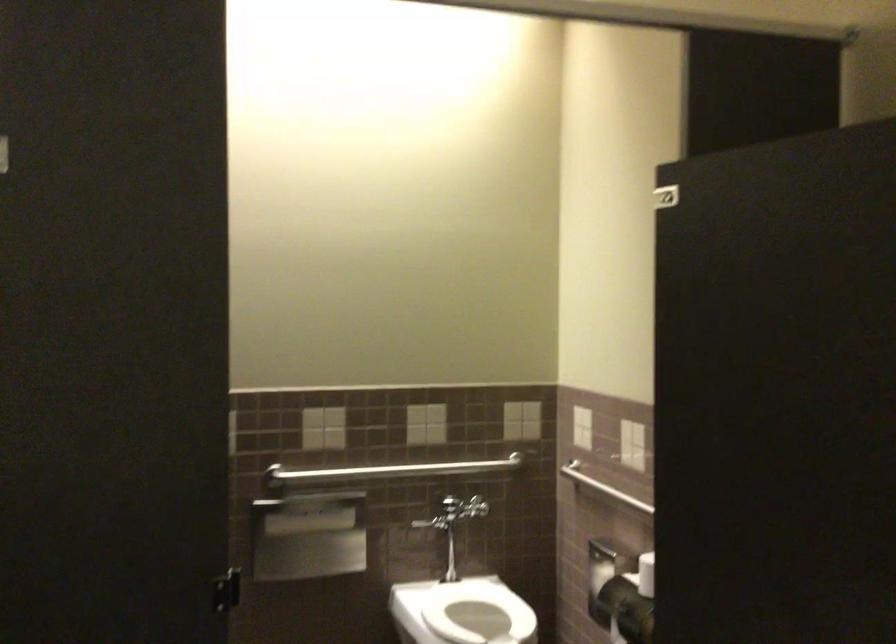
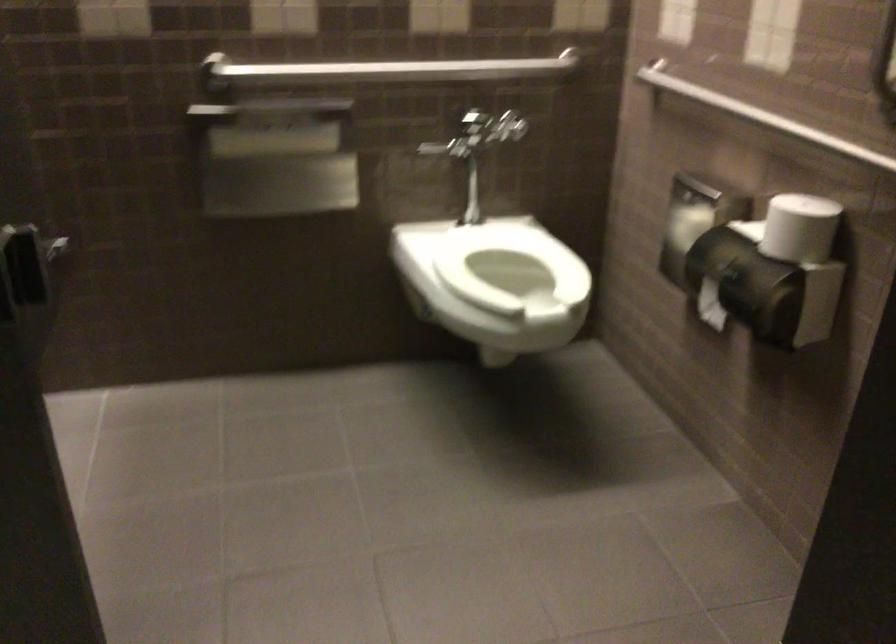
Question: The images are taken continuously from a first-person perspective. In which direction are you moving?

Choices:
 (A) Left
 (B) Right
 (C) Forward
 (D) Backward

Answer: (C)